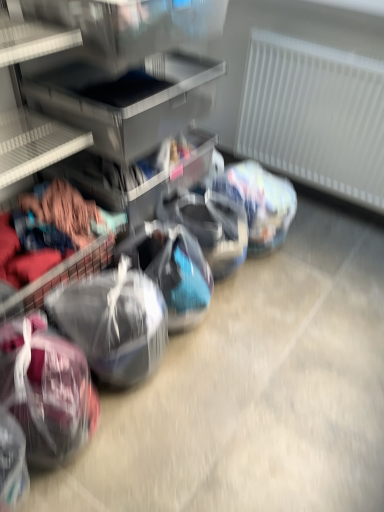
Question: From a real-world perspective, is translucent plastic sack at lower left, the 1th sack positioned from the right, above or below white textured radiator at right?

Choices:
 (A) below
 (B) above

Answer: (A)

Question: Is translucent plastic sack at lower left, which is counted as the 2th sack, starting from the left, bigger or smaller than white textured radiator at right?

Choices:
 (A) big
 (B) small

Answer: (B)

Question: Which object is positioned farthest from the white textured radiator at right?

Choices:
 (A) maroon fabric sack at lower left, which appears as the first sack when viewed from the left
 (B) translucent plastic sack at lower left, which is counted as the 2th sack, starting from the left

Answer: (A)

Question: Based on their relative distances, which object is farther from the translucent plastic sack at lower left, the 1th sack positioned from the right?

Choices:
 (A) maroon fabric sack at lower left, which appears as the first sack when viewed from the left
 (B) white textured radiator at right

Answer: (B)